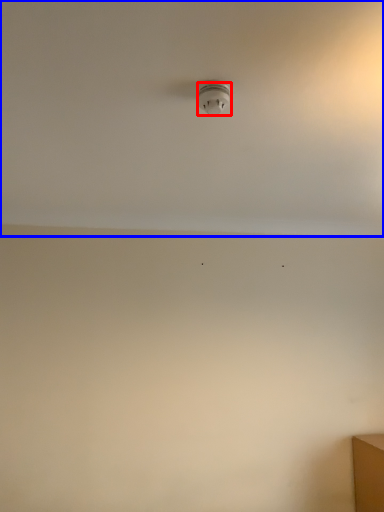
Question: Which object is further to the camera taking this photo, light fixture (highlighted by a red box) or backdrop (highlighted by a blue box)?

Choices:
 (A) light fixture
 (B) backdrop

Answer: (A)